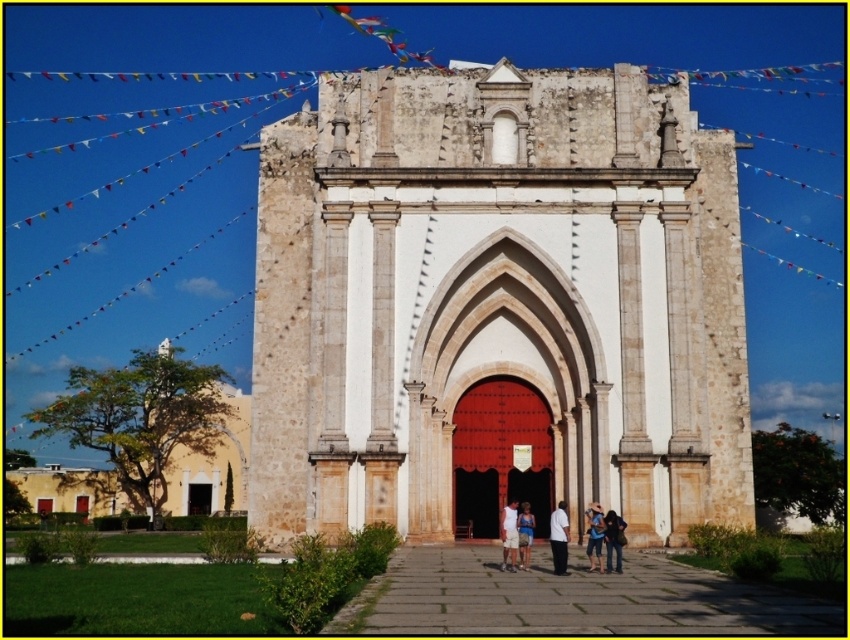
Question: Considering the real-world distances, which object is farthest from the white stone chapel at center?

Choices:
 (A) smooth wooden door at center
 (B) blue fabric shirt at center

Answer: (B)

Question: Does white cotton tank top at center lie in front of blue fabric shirt at center?

Choices:
 (A) yes
 (B) no

Answer: (A)

Question: Which of these objects is positioned farthest from the blue fabric shirt at center?

Choices:
 (A) smooth wooden door at center
 (B) blue denim jeans at lower center
 (C) denim jacket at lower center

Answer: (A)

Question: Is white matte shirt at center further to the viewer compared to blue denim jeans at lower center?

Choices:
 (A) yes
 (B) no

Answer: (B)

Question: Does white cotton tank top at center appear on the left side of denim jacket at lower center?

Choices:
 (A) yes
 (B) no

Answer: (A)

Question: Among these points, which one is farthest from the camera?

Choices:
 (A) (527, 557)
 (B) (505, 534)

Answer: (B)